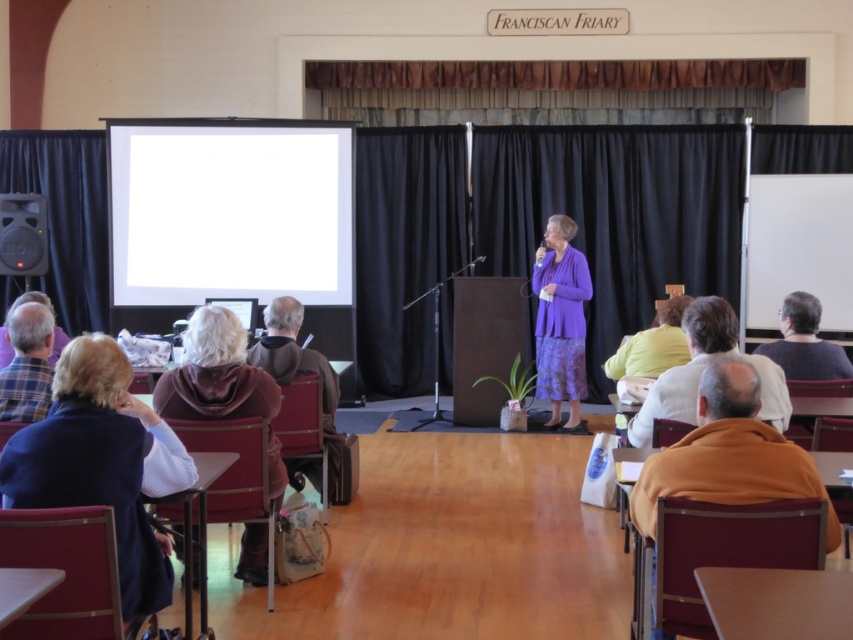
You are a stagehand in the Franciscan Friary room. You need to move a 4.5 meter long extension cord from the white glossy projection screen at upper left to the dark blue sweater at lower left. Can you safely lay the cord along the floor without it being too short?

The distance between the white glossy projection screen at upper left and the dark blue sweater at lower left is 5.07 meters. Since the extension cord is only 4.5 meters long, it is too short to cover the required distance. You will need a longer cord to ensure it reaches safely.

From the picture: You are an event organizer and need to arrange seating for attendees based on their clothing. You notice two people in the audience wearing a dark blue sweater at lower left and a plaid fabric shirt at left. Which clothing item is positioned higher up in the image?

The dark blue sweater at lower left is taller than the plaid fabric shirt at left, so the dark blue sweater at lower left is positioned higher up in the image.

You are sitting at the back of the room and want to move to the front. Which point should you walk towards first, point (30, 493) or point (24, 342)?

You should walk towards point (30, 493) first because it is in front of point (24, 342).